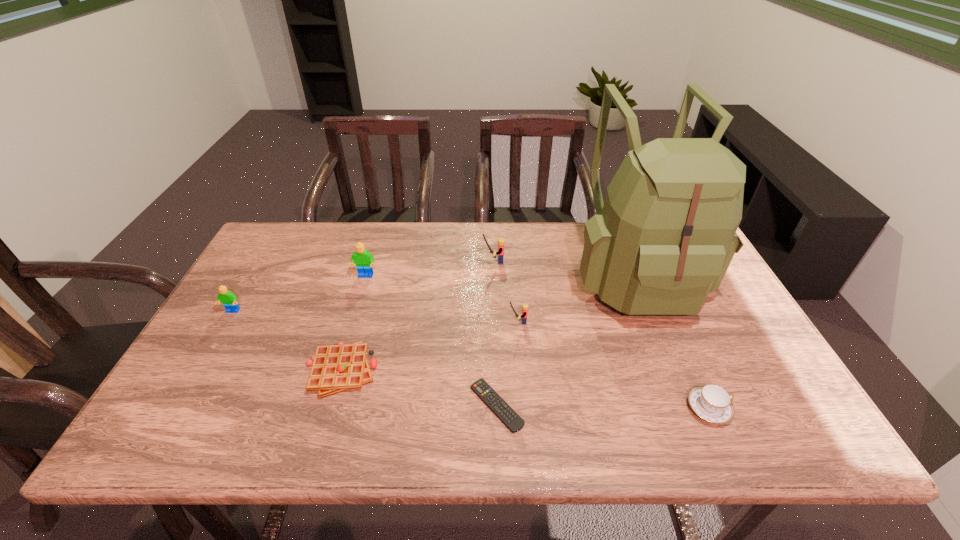
The width and height of the screenshot is (960, 540). Find the location of `backpack`. backpack is located at coordinates (664, 237).

At what (x,y) coordinates should I click in order to perform the action: click on green backpack. Please return your answer as a coordinate pair (x, y). This screenshot has width=960, height=540. Looking at the image, I should click on (664, 237).

Find the location of a particular element. The height and width of the screenshot is (540, 960). the bigger yellow Lego is located at coordinates (501, 241).

Locate an element on the screen. The width and height of the screenshot is (960, 540). the farthest Lego is located at coordinates (501, 241).

This screenshot has width=960, height=540. Identify the location of the farther green Lego. point(363,259).

Locate an element on the screen. the right green Lego is located at coordinates (363, 259).

The image size is (960, 540). What are the coordinates of `the nearest Lego` in the screenshot? It's located at (523, 317).

At what (x,y) coordinates should I click in order to perform the action: click on the smaller yellow Lego. Please return your answer as a coordinate pair (x, y). The width and height of the screenshot is (960, 540). Looking at the image, I should click on (523, 317).

Locate an element on the screen. This screenshot has height=540, width=960. the left green Lego is located at coordinates (229, 300).

Locate an element on the screen. The height and width of the screenshot is (540, 960). the nearer green Lego is located at coordinates coord(229,300).